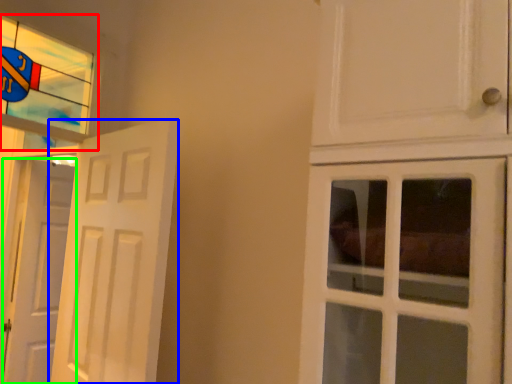
Question: Which is nearer to the window (highlighted by a red box)? door (highlighted by a blue box) or door (highlighted by a green box).

Choices:
 (A) door
 (B) door

Answer: (A)